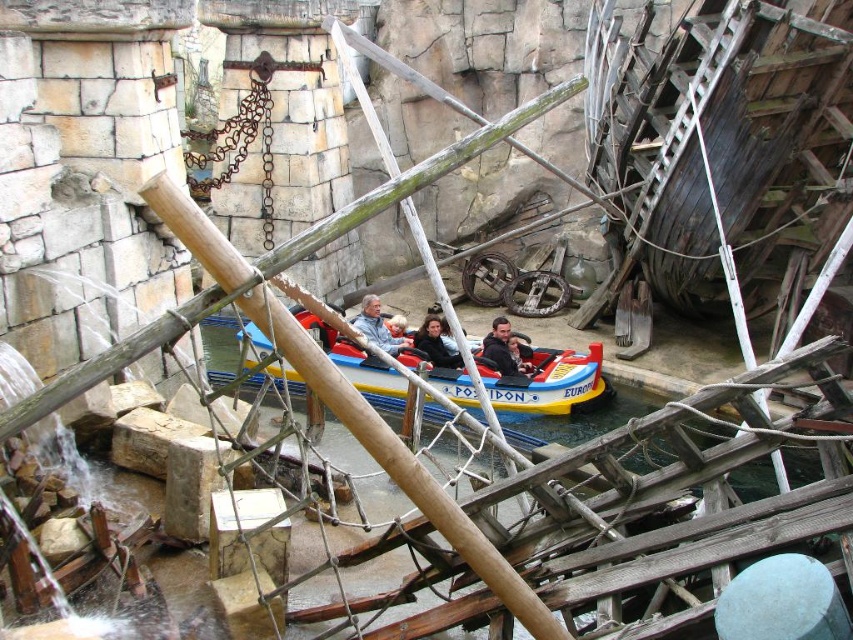
Question: Is smooth blue jacket at center wider than gray fabric jacket at center?

Choices:
 (A) yes
 (B) no

Answer: (B)

Question: Based on their relative distances, which object is nearer to the smooth blue jacket at center?

Choices:
 (A) smooth black jacket at center
 (B) yellow rubber boat at center
 (C) gray fabric jacket at center

Answer: (A)

Question: Is yellow rubber boat at center bigger than gray fabric jacket at center?

Choices:
 (A) no
 (B) yes

Answer: (B)

Question: Which of the following is the farthest from the observer?

Choices:
 (A) yellow rubber boat at center
 (B) smooth black jacket at center
 (C) smooth blue jacket at center

Answer: (B)

Question: Based on their relative distances, which object is farther from the gray fabric jacket at center?

Choices:
 (A) smooth black jacket at center
 (B) smooth blue jacket at center

Answer: (B)

Question: Does yellow rubber boat at center appear under smooth black jacket at center?

Choices:
 (A) no
 (B) yes

Answer: (B)